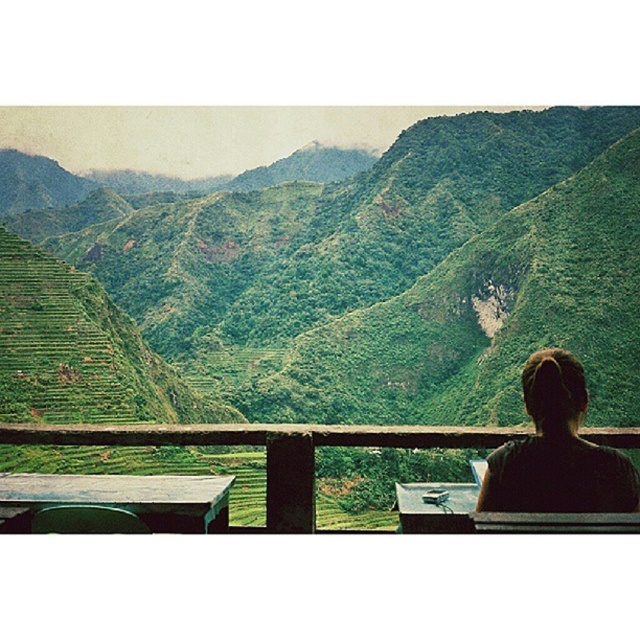
You are standing on the balcony and want to look at two points in the scene. The first point is at coordinates point (573, 403) and the second is at point (442, 516). Which point is closer to you?

Point (573, 403) is in front of point (442, 516), so the first point is closer to you.